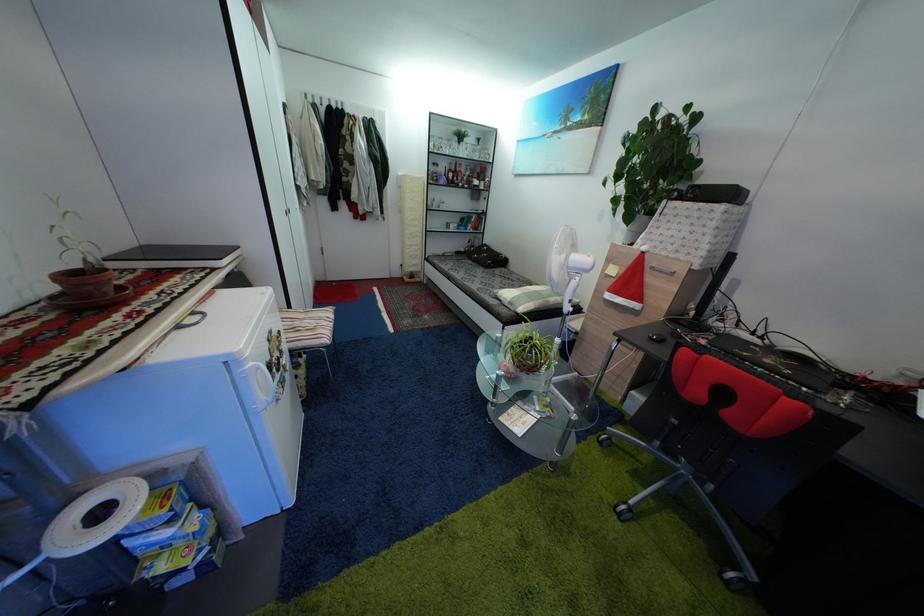
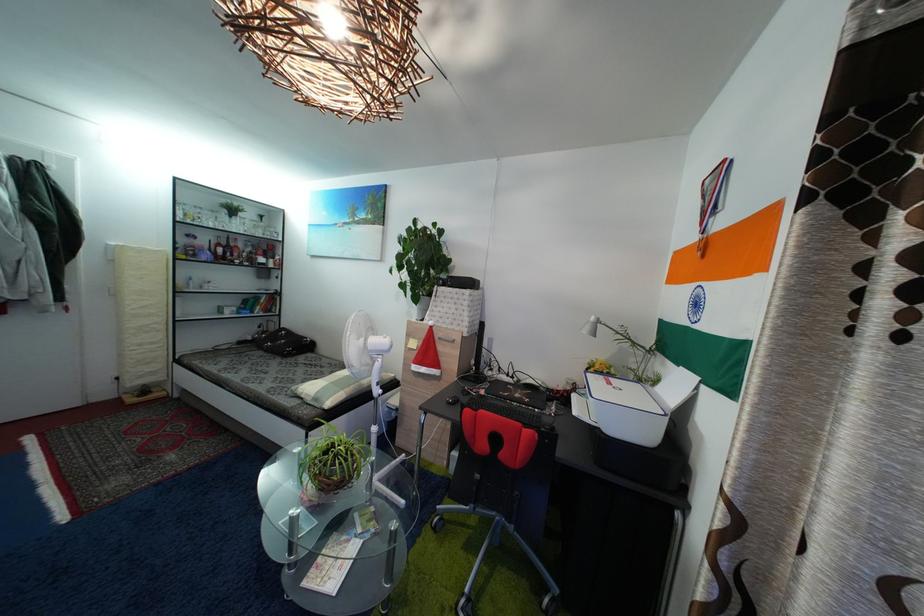
The point at (482, 148) is marked in the first image. Where is the corresponding point in the second image?

(264, 225)